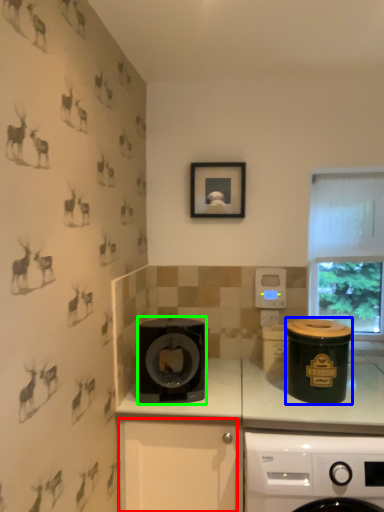
Question: Which object is positioned farthest from drawer (highlighted by a red box)? Select from appliance (highlighted by a blue box) and kitchen appliance (highlighted by a green box).

Choices:
 (A) appliance
 (B) kitchen appliance

Answer: (A)